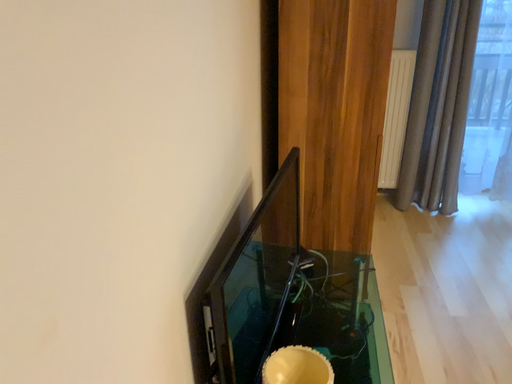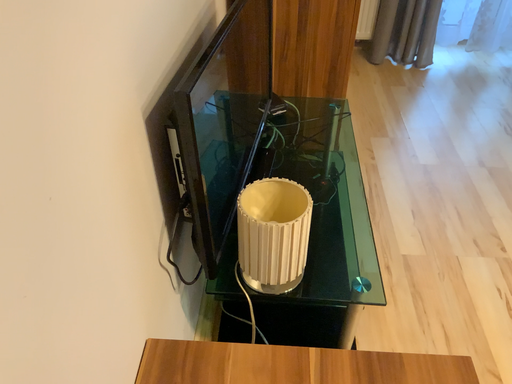
Question: How did the camera likely rotate when shooting the video?

Choices:
 (A) rotated downward
 (B) rotated upward

Answer: (A)